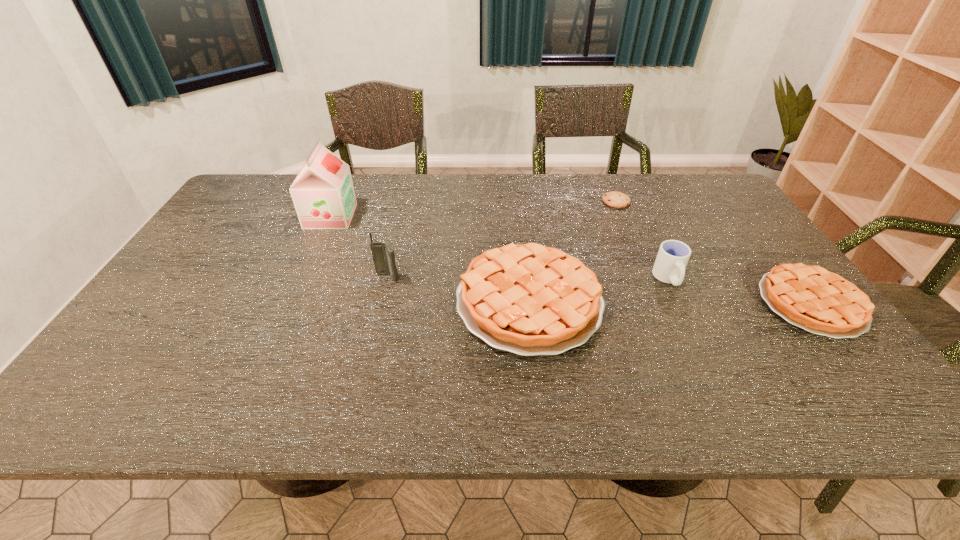
This screenshot has width=960, height=540. I want to click on the left pie, so click(528, 299).

The image size is (960, 540). Find the location of `the taller pie`. the taller pie is located at coordinates (528, 299).

This screenshot has height=540, width=960. I want to click on the rightmost object, so click(x=819, y=301).

I want to click on the right pie, so click(819, 301).

This screenshot has height=540, width=960. In order to click on the shortest object in this screenshot , I will do `click(616, 199)`.

Where is `the third tallest object`? the third tallest object is located at coordinates (669, 267).

Locate an element on the screen. soya milk is located at coordinates (323, 194).

Locate an element on the screen. The image size is (960, 540). the leftmost object is located at coordinates (323, 194).

Find the location of a particular element. The image size is (960, 540). the second object from left to right is located at coordinates (383, 254).

The height and width of the screenshot is (540, 960). I want to click on the second tallest object, so click(x=383, y=254).